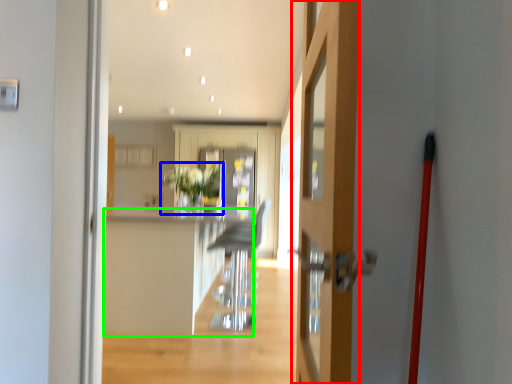
Question: Which object is positioned closest to door (highlighted by a red box)? Select from plant (highlighted by a blue box) and counter top (highlighted by a green box).

Choices:
 (A) plant
 (B) counter top

Answer: (B)